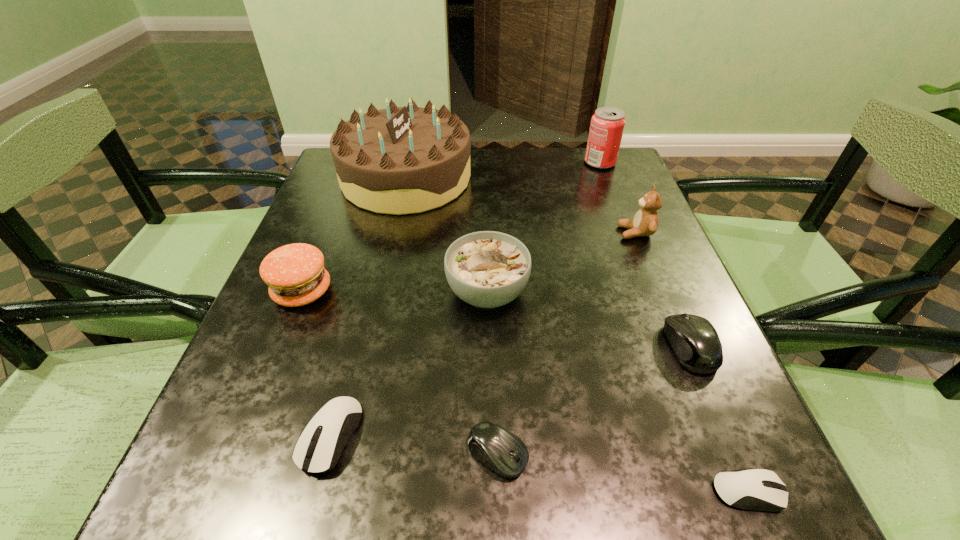
Where is `vacant region at the near left corner of the desktop`? The height and width of the screenshot is (540, 960). vacant region at the near left corner of the desktop is located at coordinates (176, 518).

Where is `vacant area at the far right corner of the desktop`? vacant area at the far right corner of the desktop is located at coordinates (568, 148).

Find the location of `empty space between the second tallest object and the farther black mouse`. empty space between the second tallest object and the farther black mouse is located at coordinates (645, 255).

Identify the location of vacant space in between the tallest mouse and the brown birthday cake. The width and height of the screenshot is (960, 540). (548, 262).

Locate an element on the screen. This screenshot has height=540, width=960. free space that is in between the soda can and the second mouse from left to right is located at coordinates (549, 308).

The height and width of the screenshot is (540, 960). Identify the location of vacant area that lies between the tallest mouse and the patty. (496, 319).

The height and width of the screenshot is (540, 960). What are the coordinates of `free space between the leftmost mouse and the white soup bowl` in the screenshot? It's located at (409, 364).

At what (x,y) coordinates should I click in order to perform the action: click on vacant area that lies between the soup bowl and the patty. Please return your answer as a coordinate pair (x, y). The height and width of the screenshot is (540, 960). Looking at the image, I should click on (395, 292).

Image resolution: width=960 pixels, height=540 pixels. In order to click on free space between the left black mouse and the right black mouse in this screenshot , I will do `click(593, 400)`.

Identify the location of free point between the smaller white mouse and the tallest mouse. (719, 420).